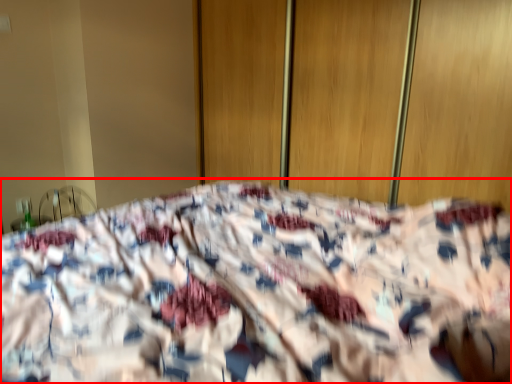
Question: From the image, what is the correct spatial relationship of bed (annotated by the red box) in relation to screen door?

Choices:
 (A) right
 (B) left

Answer: (B)